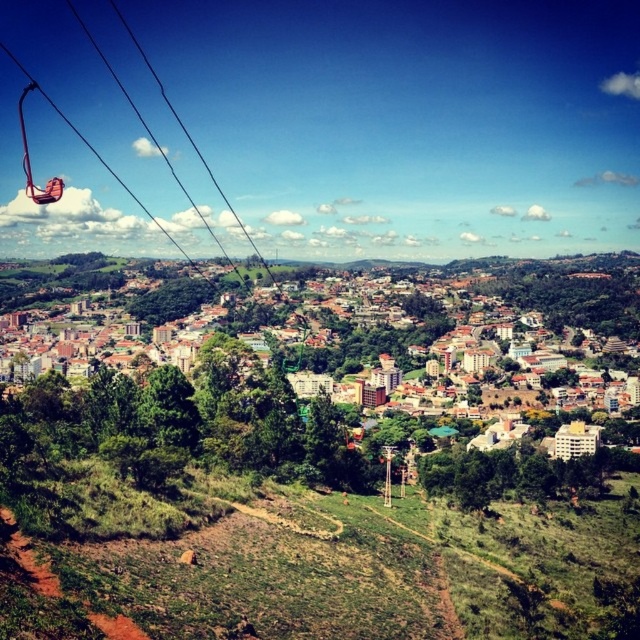
You are standing at the point marked as point (333, 390) in the image. What do you see directly in front of you?

At point (333, 390) lies green leafy trees at center, so you would see green leafy trees at center directly in front of you.

You are a bird flying at an altitude of 1000 feet above the ground. You spot the green leafy trees at center from your current position. Can you safely land between them without hitting any obstacles?

The green leafy trees at center are 1109.53 feet apart, so yes, the bird can safely land between them as the distance is greater than the bird s altitude of 1000 feet.